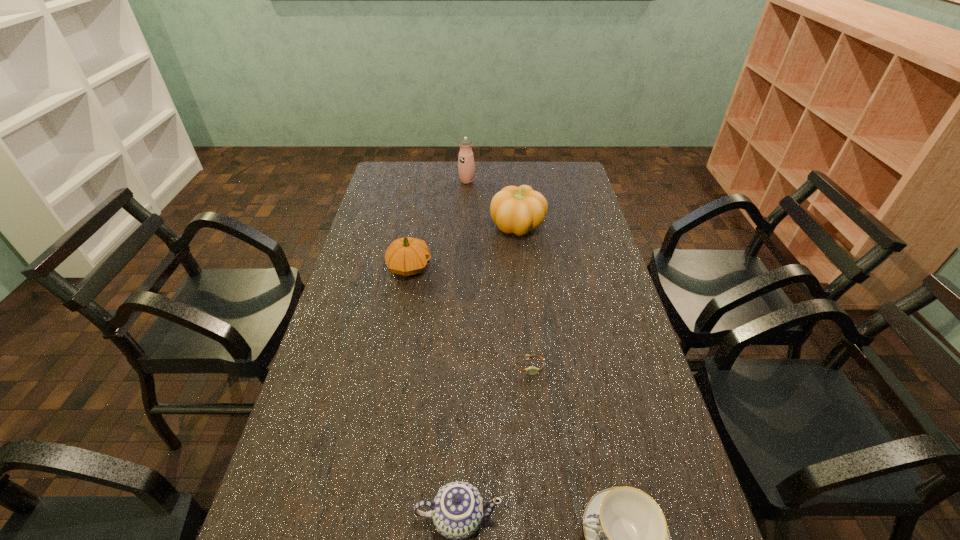
The height and width of the screenshot is (540, 960). What are the coordinates of `the farthest object` in the screenshot? It's located at (466, 166).

You are a GUI agent. You are given a task and a screenshot of the screen. Output one action in this format:
    pyautogui.click(x=<x>, y=<y>)
    Task: Click on the tallest object
    The image size is (960, 540).
    Given the screenshot: What is the action you would take?
    pyautogui.click(x=466, y=166)

Image resolution: width=960 pixels, height=540 pixels. I want to click on the fifth shortest object, so click(x=516, y=210).

What are the coordinates of `the fifth nearest object` in the screenshot? It's located at (516, 210).

Locate an element on the screen. the third tallest object is located at coordinates (406, 256).

Locate an element on the screen. the leftmost object is located at coordinates (406, 256).

Where is `the third nearest object`? This screenshot has width=960, height=540. the third nearest object is located at coordinates (532, 370).

Image resolution: width=960 pixels, height=540 pixels. In order to click on the shortest object in this screenshot , I will do `click(532, 370)`.

This screenshot has width=960, height=540. What are the coordinates of `vacant space located on the front of the farthest object` in the screenshot? It's located at (465, 236).

Find the location of a particular element. free space located on the left of the pumpkin is located at coordinates (469, 226).